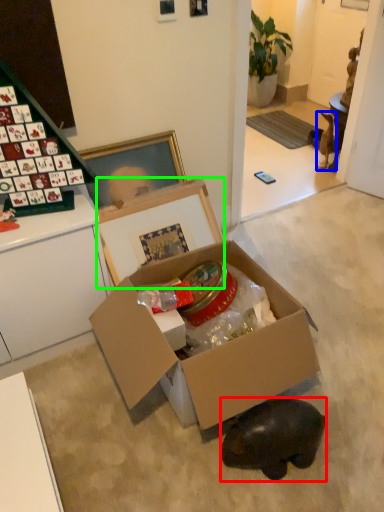
Question: Based on their relative distances, which object is nearer to animal (highlighted by a red box)? Choose from animal (highlighted by a blue box) and cardboard box (highlighted by a green box).

Choices:
 (A) animal
 (B) cardboard box

Answer: (B)